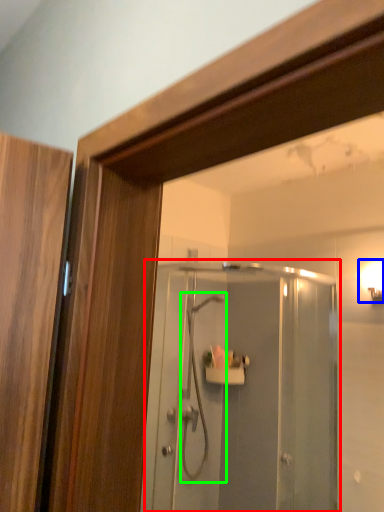
Question: Estimate the real-world distances between objects in this image. Which object is closer to screen door (highlighted by a red box), light fixture (highlighted by a blue box) or shower (highlighted by a green box)?

Choices:
 (A) light fixture
 (B) shower

Answer: (B)